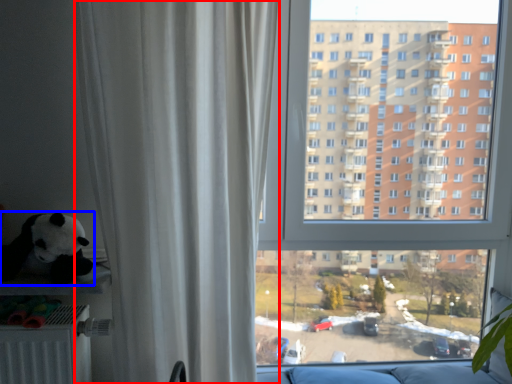
Question: Which point is closer to the camera, curtain (highlighted by a red box) or toy (highlighted by a blue box)?

Choices:
 (A) curtain
 (B) toy

Answer: (A)